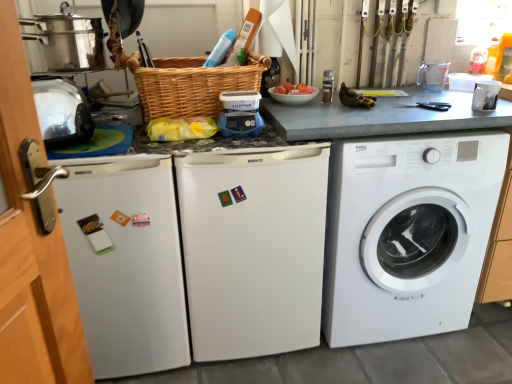
Question: Based on their sizes in the image, would you say white glossy mug at upper right, the 1th appliance positioned from the right, is bigger or smaller than shiny metallic toaster at left, which appears as the 1th appliance when viewed from the left?

Choices:
 (A) big
 (B) small

Answer: (B)

Question: Do you think white glossy mug at upper right, arranged as the fourth appliance when viewed from the left, is within shiny metallic toaster at left, the 4th appliance in the right-to-left sequence, or outside of it?

Choices:
 (A) inside
 (B) outside

Answer: (B)

Question: Considering the real-world distances, which object is farthest from the shiny metallic toaster at left, the 4th appliance in the right-to-left sequence?

Choices:
 (A) blue plastic scale at center, the 2th appliance positioned from the left
 (B) white matte dishwasher at center, which is counted as the first dish washer, starting from the right
 (C) white matte washing machine at right
 (D) matte black grinder at upper center, arranged as the second appliance when viewed from the right
 (E) white matte dishwasher at left, placed as the 2th dish washer when sorted from right to left

Answer: (C)

Question: Which of these objects is positioned closest to the woven brown basket at center?

Choices:
 (A) shiny metallic toaster at left, which appears as the 1th appliance when viewed from the left
 (B) white matte dishwasher at center, which ranks as the second dish washer in left-to-right order
 (C) white matte washing machine at right
 (D) white matte dishwasher at left, placed as the 2th dish washer when sorted from right to left
 (E) white glossy mug at upper right, arranged as the fourth appliance when viewed from the left

Answer: (A)